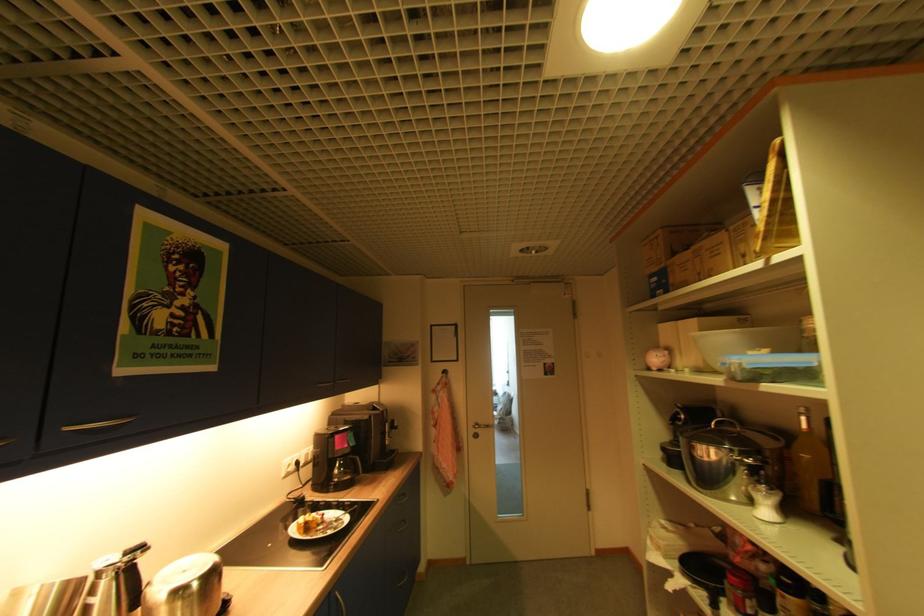
Identify the location of silver door handle. This screenshot has width=924, height=616. [x=481, y=427].